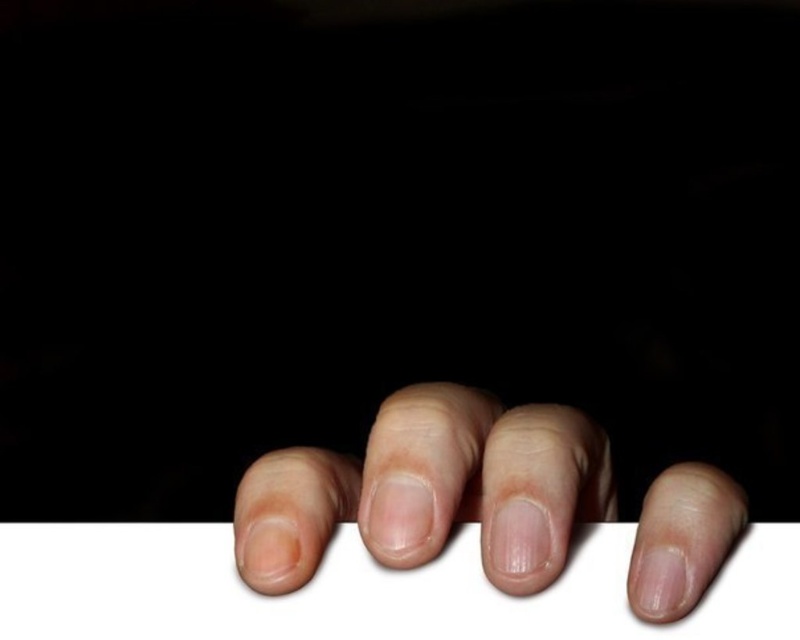
You are a graphic designer trying to place a smooth skin hand at lower center onto a white matte paper at bottom. Based on the scene, can the hand fit entirely on the paper?

The white matte paper at bottom might be wider than smooth skin hand at lower center, so there is a possibility that the hand can fit, but it depends on the exact dimensions.

You are a photographer setting up a photo shoot. You have a white matte paper at bottom and a smooth skin hand at lower center in your frame. Which object is located beneath the other?

The white matte paper at bottom is positioned under the smooth skin hand at lower center.